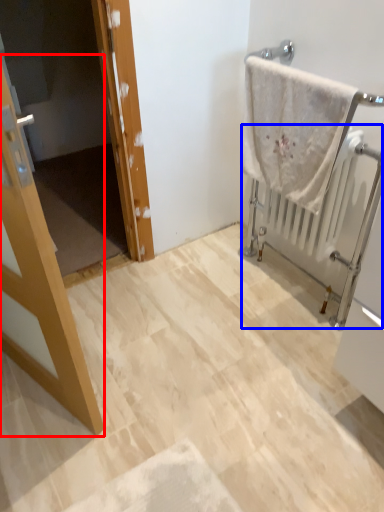
Question: Which point is closer to the camera, door (highlighted by a red box) or radiator (highlighted by a blue box)?

Choices:
 (A) door
 (B) radiator

Answer: (A)